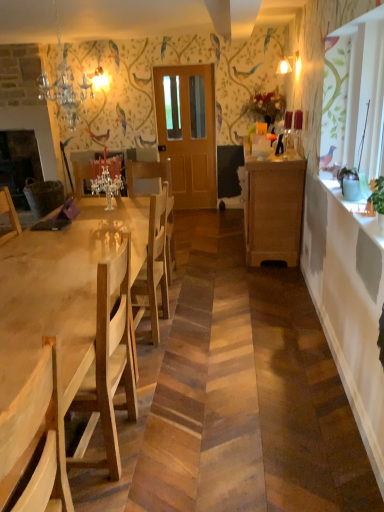
Question: Is point (248, 210) positioned closer to the camera than point (74, 97)?

Choices:
 (A) farther
 (B) closer

Answer: (B)

Question: Is wooden cabinet at right inside the boundaries of crystal glass chandelier at upper left, acting as the 2th lamp starting from the back, or outside?

Choices:
 (A) inside
 (B) outside

Answer: (B)

Question: Considering the real-world distances, which object is farthest from the light brown wooden door at center?

Choices:
 (A) white glossy counter top at upper right
 (B) light wood table at center
 (C) matte glass lampshade at upper center, the second lamp when ordered from front to back
 (D) wooden cabinet at right
 (E) light wood chair at left

Answer: (E)

Question: Estimate the real-world distances between objects in this image. Which object is farther from the white glossy counter top at upper right?

Choices:
 (A) wooden cabinet at right
 (B) light brown wooden door at center
 (C) matte glass lampshade at upper center, the 2th lamp when ordered from left to right
 (D) light wood table at center
 (E) light wood chair at left

Answer: (B)